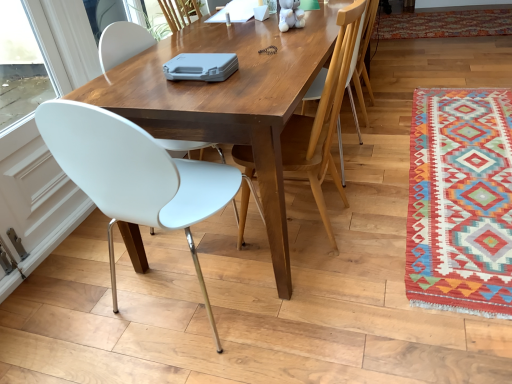
In order to click on free space between wooden chair at upper right, the 3th chair in the left-to-right sequence, and multicolored woven rug at lower right, which is counted as the 1th mat, starting from the front in this screenshot , I will do `click(385, 164)`.